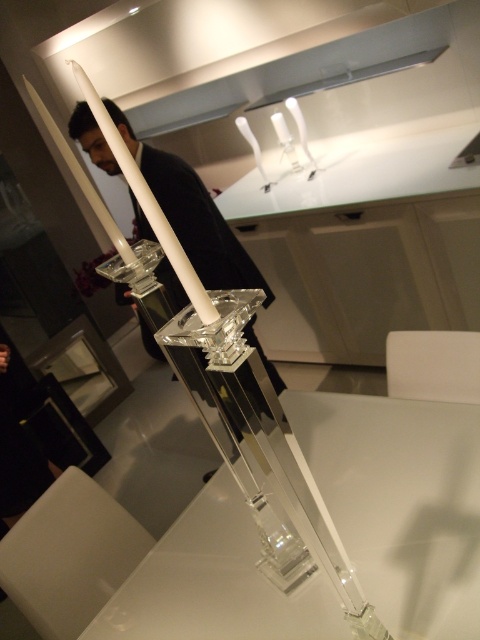
What do you see at coordinates (192, 216) in the screenshot? This screenshot has width=480, height=640. I see `matte black suit at center` at bounding box center [192, 216].

Is the position of matte black suit at center more distant than that of white glossy exhaust hood at upper center?

No, it is in front of white glossy exhaust hood at upper center.

Locate an element on the screen. matte black suit at center is located at coordinates pos(192,216).

Is point (203, 486) positioned in front of point (215, 230)?

Yes.

Does clear acrylic table at center appear on the left side of matte black suit at center?

Incorrect, clear acrylic table at center is not on the left side of matte black suit at center.

Locate an element on the screen. The height and width of the screenshot is (640, 480). clear acrylic table at center is located at coordinates (400, 502).

This screenshot has width=480, height=640. Find the location of `clear acrylic table at center`. clear acrylic table at center is located at coordinates click(400, 502).

Which is above, clear acrylic table at center or white glossy exhaust hood at upper center?

white glossy exhaust hood at upper center is above.

Is clear acrylic table at center to the right of white glossy exhaust hood at upper center from the viewer's perspective?

Incorrect, clear acrylic table at center is not on the right side of white glossy exhaust hood at upper center.

Identify the location of clear acrylic table at center. (400, 502).